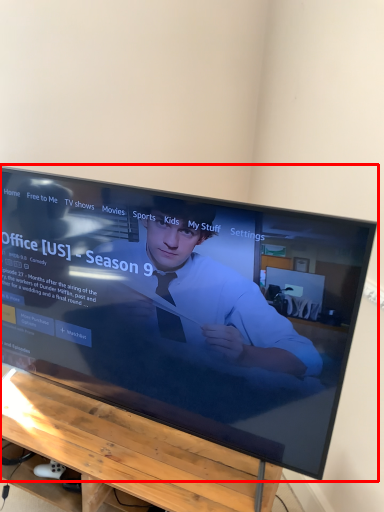
Question: In this image, where is television (annotated by the red box) located relative to furniture?

Choices:
 (A) right
 (B) left

Answer: (A)